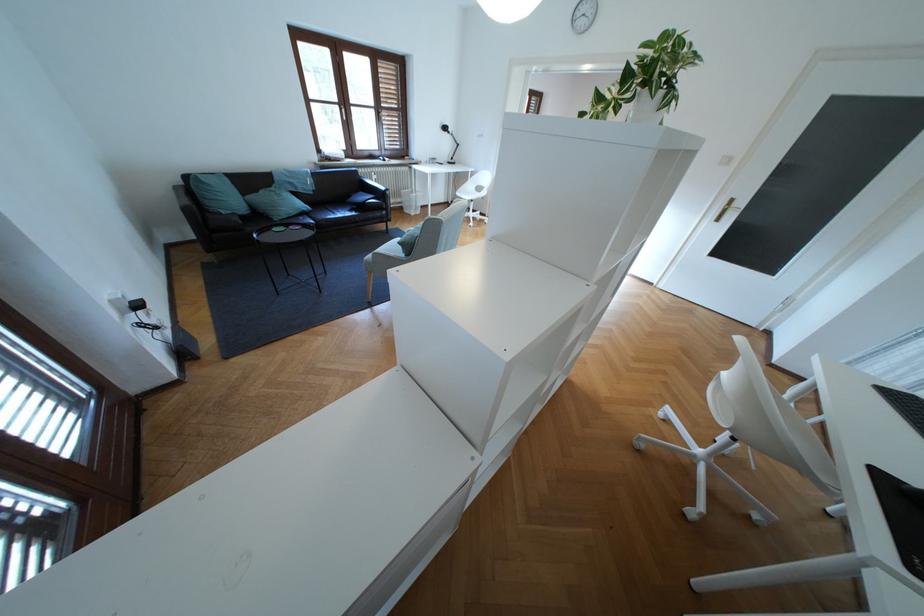
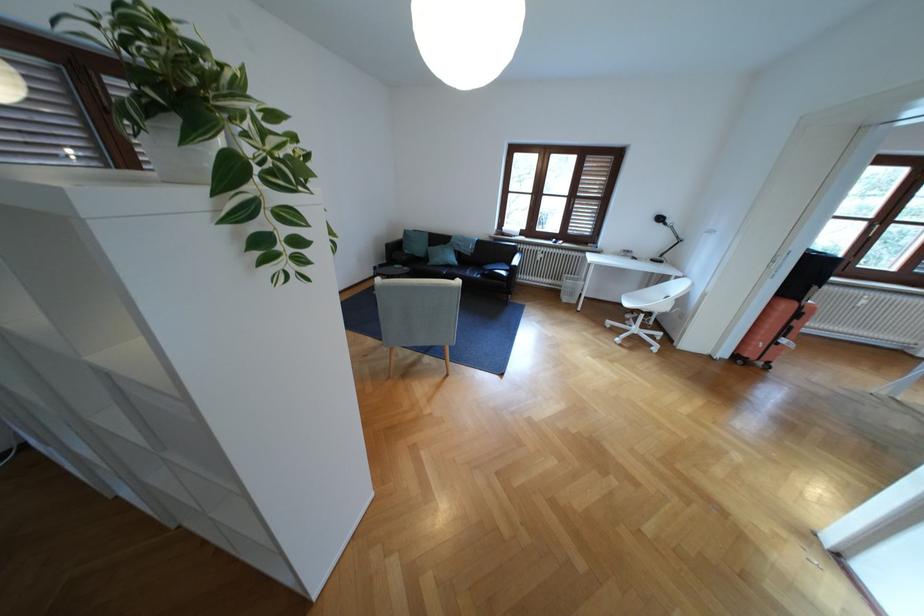
Where in the second image is the point corresponding to point 234,213 from the first image?

(417, 252)